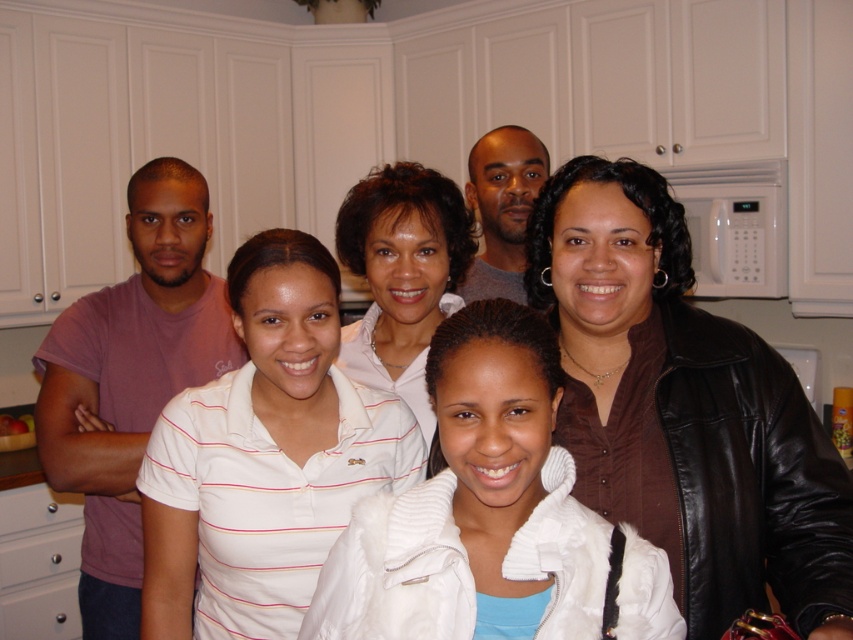
Question: Does brown leather jacket at upper right lie in front of white fleece jacket at center?

Choices:
 (A) yes
 (B) no

Answer: (B)

Question: Is brown leather jacket at upper right further to camera compared to white fleece jacket at center?

Choices:
 (A) yes
 (B) no

Answer: (A)

Question: Is brown leather jacket at upper right above white matte jacket at center?

Choices:
 (A) yes
 (B) no

Answer: (B)

Question: Based on their relative distances, which object is nearer to the brown leather jacket at upper right?

Choices:
 (A) white matte jacket at center
 (B) white fleece jacket at center
 (C) white striped polo shirt at center

Answer: (B)

Question: Among these objects, which one is nearest to the camera?

Choices:
 (A) white fleece jacket at center
 (B) white striped polo shirt at center

Answer: (A)

Question: Which point is closer to the camera?

Choices:
 (A) (848, 556)
 (B) (405, 310)
 (C) (274, 381)
 (D) (373, 586)

Answer: (D)